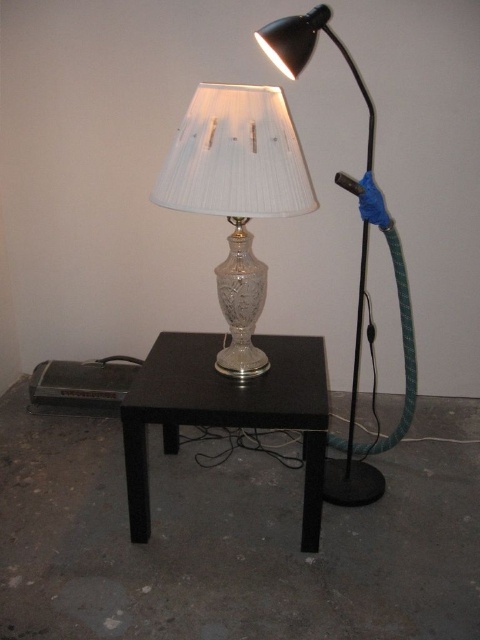
Question: Among these objects, which one is farthest from the camera?

Choices:
 (A) green rubber hose at right
 (B) matte silver glass table lamp at right
 (C) black glossy table at center
 (D) silver textured glass table lamp at center

Answer: (B)

Question: Which object is farther from the camera taking this photo?

Choices:
 (A) black glossy table at center
 (B) green rubber hose at right
 (C) silver textured glass table lamp at center
 (D) matte silver glass table lamp at right

Answer: (D)

Question: Does silver textured glass table lamp at center have a smaller size compared to black glossy table at center?

Choices:
 (A) yes
 (B) no

Answer: (A)

Question: Which is nearer to the silver textured glass table lamp at center?

Choices:
 (A) black glossy table at center
 (B) green rubber hose at right

Answer: (A)

Question: Considering the relative positions of silver textured glass table lamp at center and green rubber hose at right in the image provided, where is silver textured glass table lamp at center located with respect to green rubber hose at right?

Choices:
 (A) left
 (B) right

Answer: (A)

Question: Does silver textured glass table lamp at center appear over black glossy table at center?

Choices:
 (A) yes
 (B) no

Answer: (A)